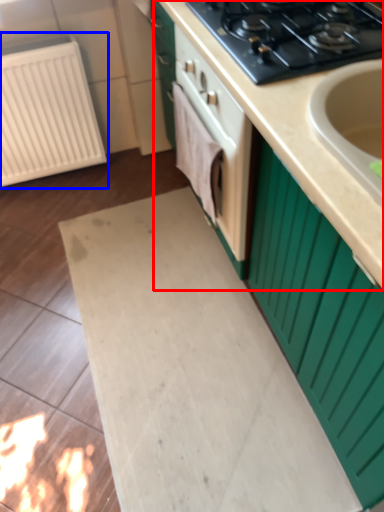
Question: Among these objects, which one is farthest to the camera, countertop (highlighted by a red box) or radiator (highlighted by a blue box)?

Choices:
 (A) countertop
 (B) radiator

Answer: (B)